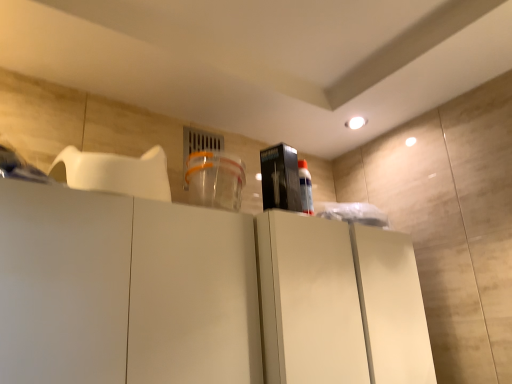
Question: From the image's perspective, is matte white cabinet at center positioned above or below black plastic box at center?

Choices:
 (A) below
 (B) above

Answer: (A)

Question: Would you say matte white cabinet at center is to the left or to the right of black plastic box at center in the picture?

Choices:
 (A) right
 (B) left

Answer: (A)

Question: Is matte white cabinet at center situated inside black plastic box at center or outside?

Choices:
 (A) inside
 (B) outside

Answer: (B)

Question: Looking at their shapes, would you say black plastic box at center is wider or thinner than matte white cabinet at center?

Choices:
 (A) thin
 (B) wide

Answer: (A)

Question: Is black plastic box at center inside or outside of matte white cabinet at center?

Choices:
 (A) outside
 (B) inside

Answer: (A)

Question: From the image's perspective, relative to matte white cabinet at center, is black plastic box at center above or below?

Choices:
 (A) above
 (B) below

Answer: (A)

Question: Does point (289, 195) appear closer or farther from the camera than point (410, 246)?

Choices:
 (A) closer
 (B) farther

Answer: (A)